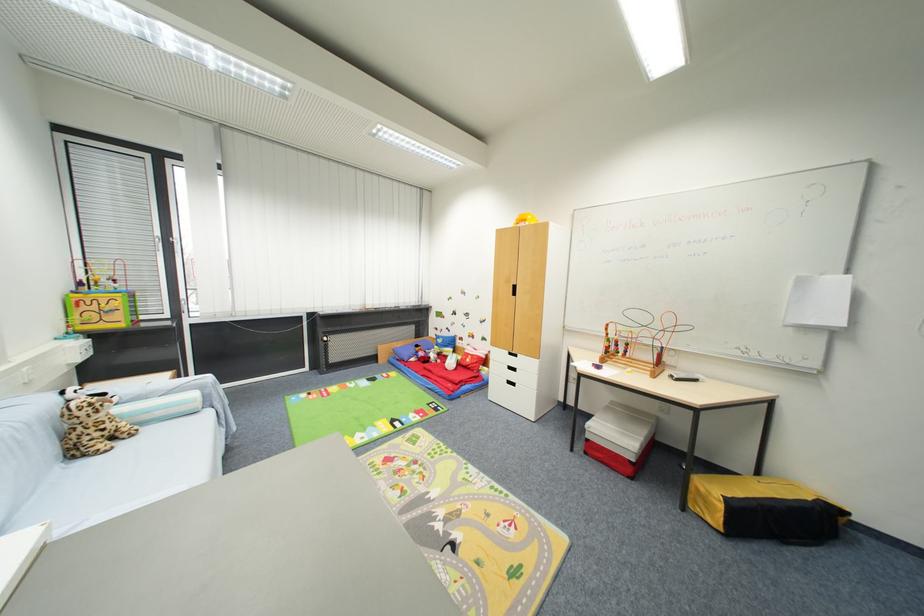
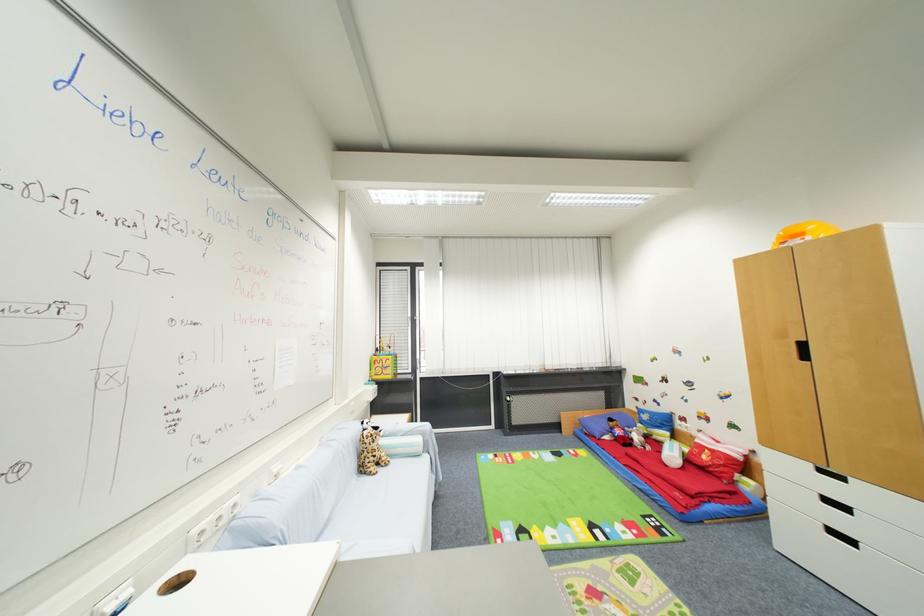
In the second image, find the point that corresponds to the point at 79,456 in the first image.

(367, 472)